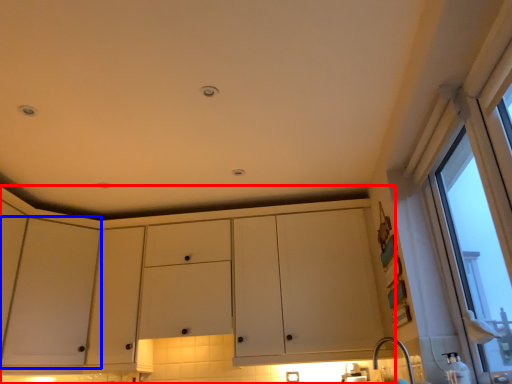
Question: Which object is further to the camera taking this photo, cabinetry (highlighted by a red box) or screen door (highlighted by a blue box)?

Choices:
 (A) cabinetry
 (B) screen door

Answer: (A)